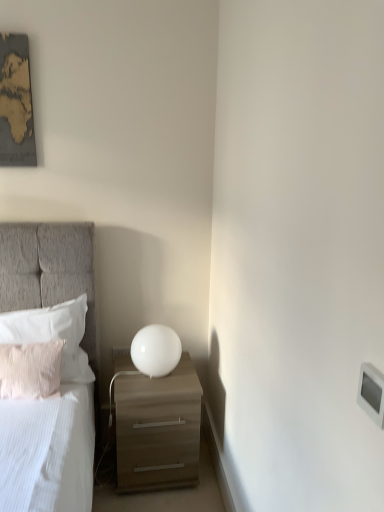
The width and height of the screenshot is (384, 512). What are the coordinates of `free point above beige textured pillow at left, which is the first pillow from front to back (from a real-world perspective)` in the screenshot? It's located at (23, 342).